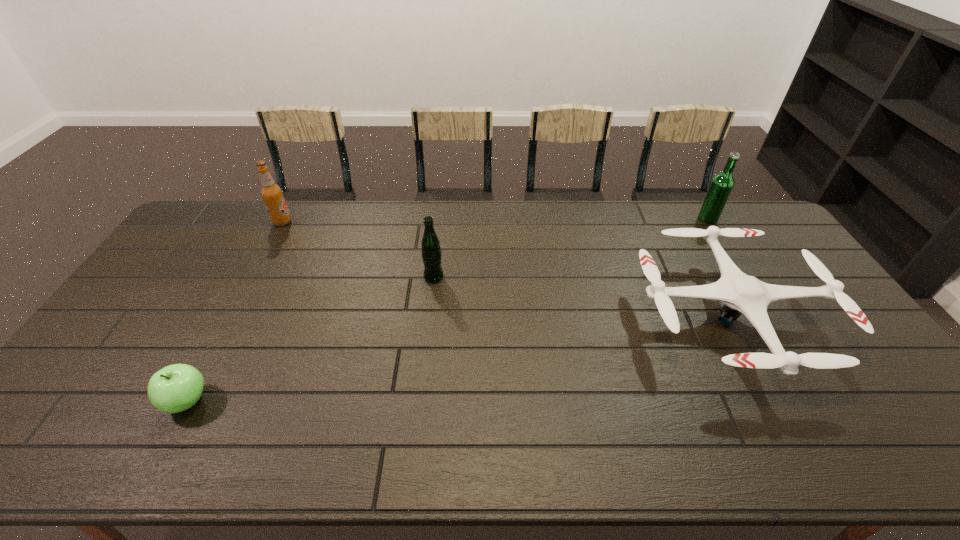
This screenshot has height=540, width=960. What are the coordinates of `the rightmost beer bottle` in the screenshot? It's located at point(722,184).

Where is `the leftmost beer bottle`? the leftmost beer bottle is located at coordinates (272, 194).

I want to click on the third object from right to left, so click(x=431, y=253).

Image resolution: width=960 pixels, height=540 pixels. In order to click on the nearest beer bottle in this screenshot , I will do `click(431, 253)`.

This screenshot has width=960, height=540. I want to click on drone, so click(x=741, y=293).

Locate an element on the screen. This screenshot has height=540, width=960. the shortest object is located at coordinates (175, 388).

You are a GUI agent. You are given a task and a screenshot of the screen. Output one action in this format:
    pyautogui.click(x=<x>, y=<y>)
    Task: Click on the vacant space located on the left of the rightmost beer bottle
    The image size is (960, 540).
    Given the screenshot: What is the action you would take?
    pyautogui.click(x=625, y=219)

Find the location of a particular element. This screenshot has height=540, width=960. free space located 0.320m on the front label of the leftmost beer bottle is located at coordinates (380, 222).

You are a GUI agent. You are given a task and a screenshot of the screen. Output one action in this format:
    pyautogui.click(x=<x>, y=<y>)
    Task: Click on the vacant region located on the front of the third object from left to right
    The image size is (960, 540).
    Given the screenshot: What is the action you would take?
    pyautogui.click(x=422, y=381)

This screenshot has height=540, width=960. In order to click on free region located with the camera attached at the bottom of the second shortest object in this screenshot , I will do `click(807, 462)`.